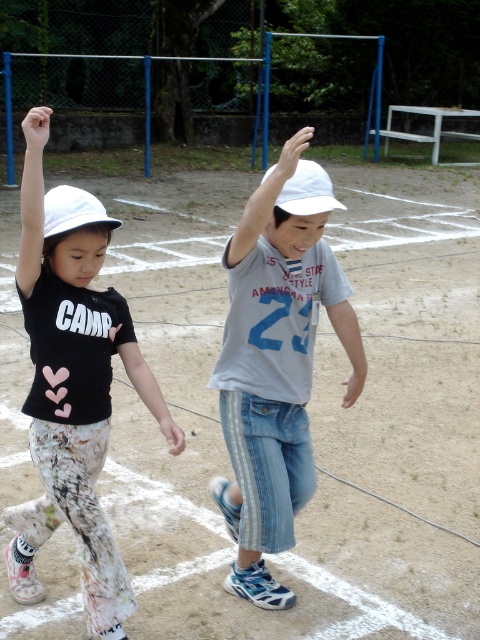
Question: Considering the relative positions of white matte baseball hat at upper left and white matte hand at upper left in the image provided, where is white matte baseball hat at upper left located with respect to white matte hand at upper left?

Choices:
 (A) left
 (B) right

Answer: (B)

Question: Which point is closer to the camera?

Choices:
 (A) white matte pants at left
 (B) white matte hand at upper center
 (C) pink matte hand at center
 (D) white matte baseball hat at upper center

Answer: (A)

Question: Is white matte hand at upper center wider than white matte hand at upper left?

Choices:
 (A) no
 (B) yes

Answer: (A)

Question: Which of the following is the farthest from the observer?

Choices:
 (A) (357, 376)
 (B) (346, 298)
 (C) (310, 204)

Answer: (A)

Question: Which object appears farthest from the camera in this image?

Choices:
 (A) pink matte hand at center
 (B) white cotton shirt at center
 (C) pink fabric hand at center

Answer: (A)

Question: Is white cotton shirt at center further to the viewer compared to white matte hand at upper center?

Choices:
 (A) no
 (B) yes

Answer: (B)